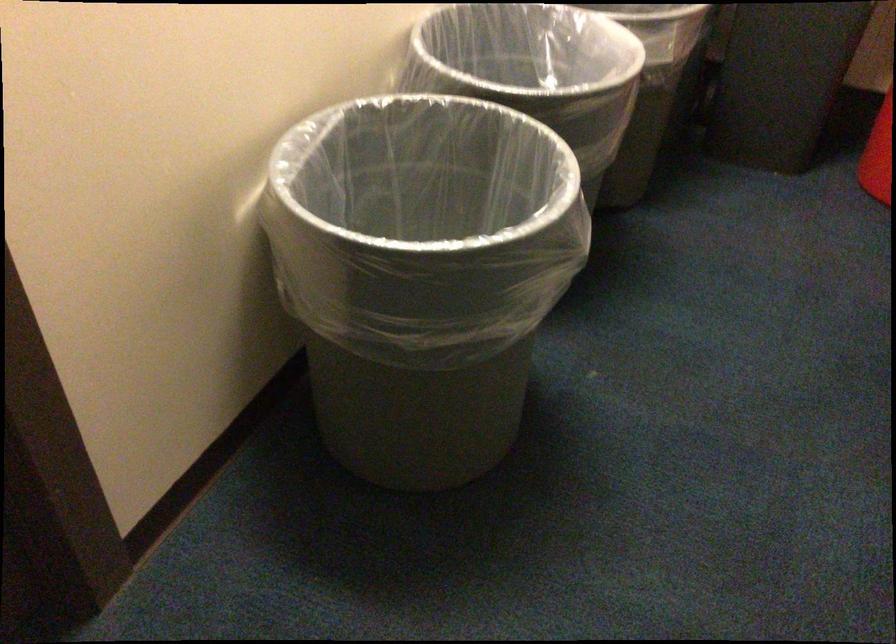
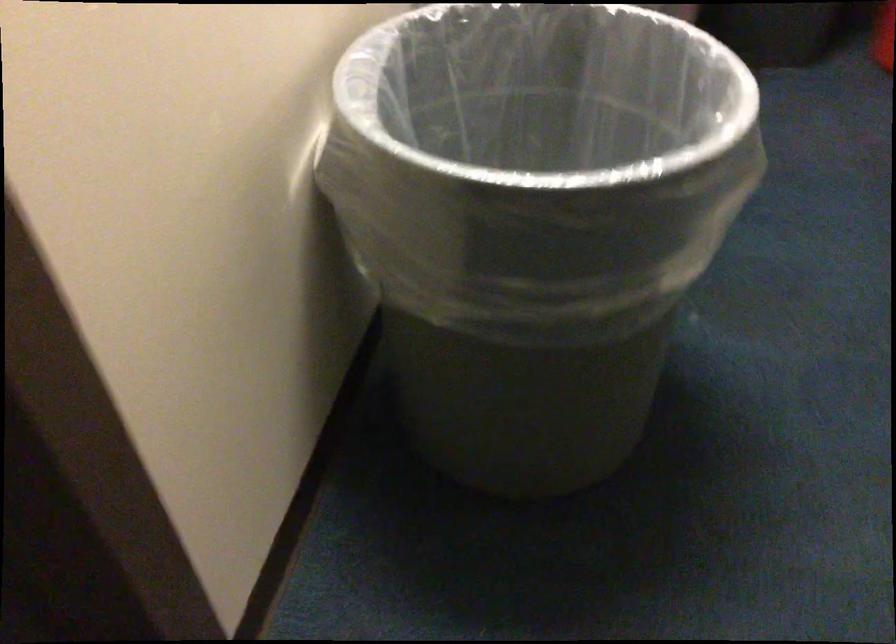
Find the pixel in the second image that matches (464,200) in the first image.

(538, 136)